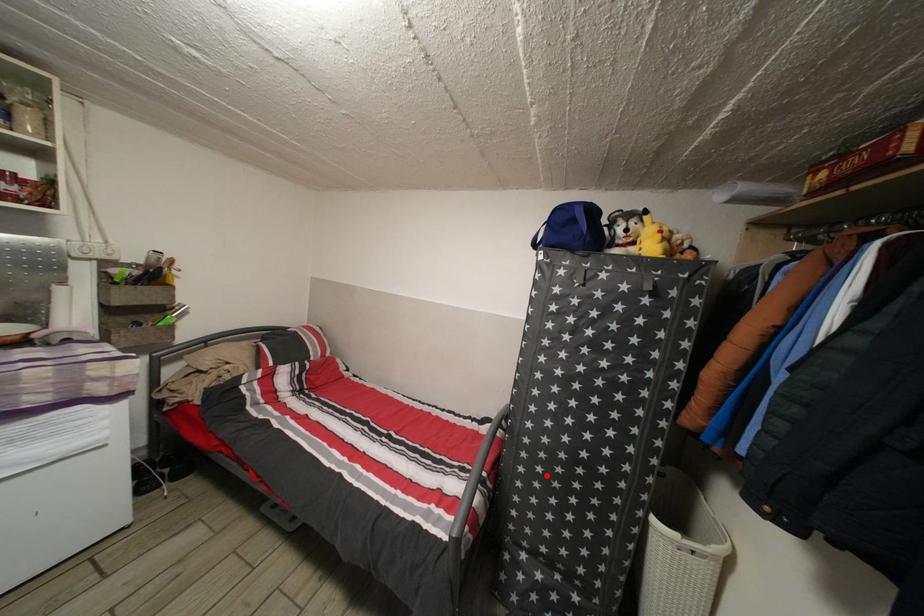
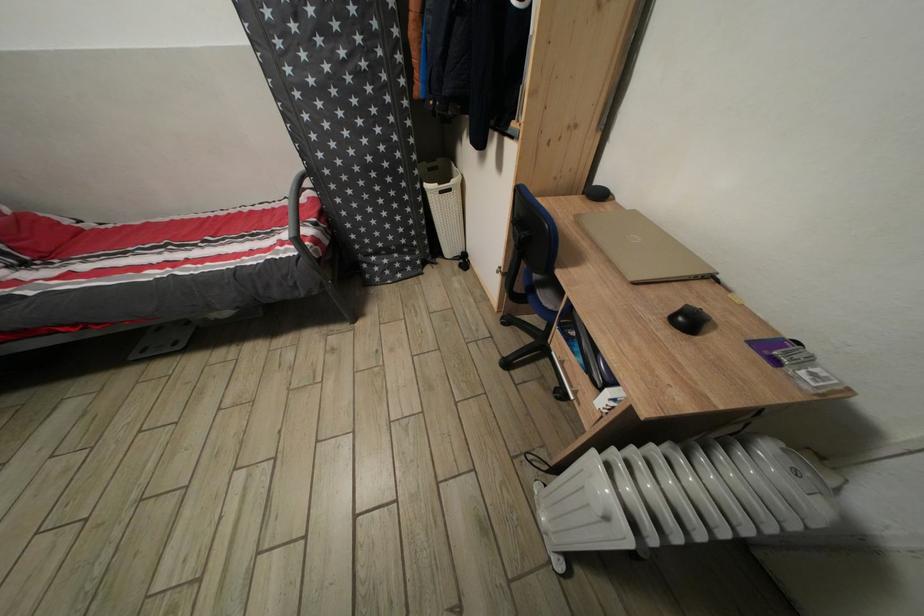
Question: I am providing you with two images of the same scene from different viewpoints. Image1 has a red point marked. In image2, the corresponding 3D location appears at what relative position? Reply with the corresponding letter.

Choices:
 (A) Closer
 (B) Farther

Answer: (A)